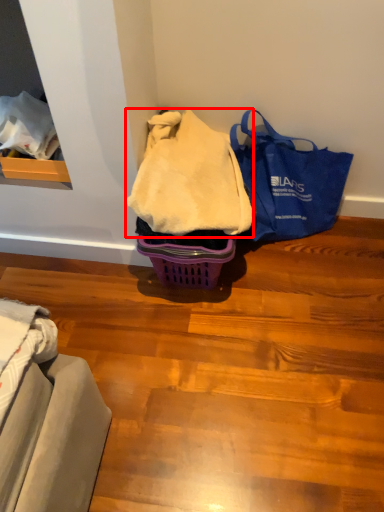
Question: From the image's perspective, considering the relative positions of blanket (annotated by the red box) and handbag in the image provided, where is blanket (annotated by the red box) located with respect to the staircase?

Choices:
 (A) below
 (B) above

Answer: (B)